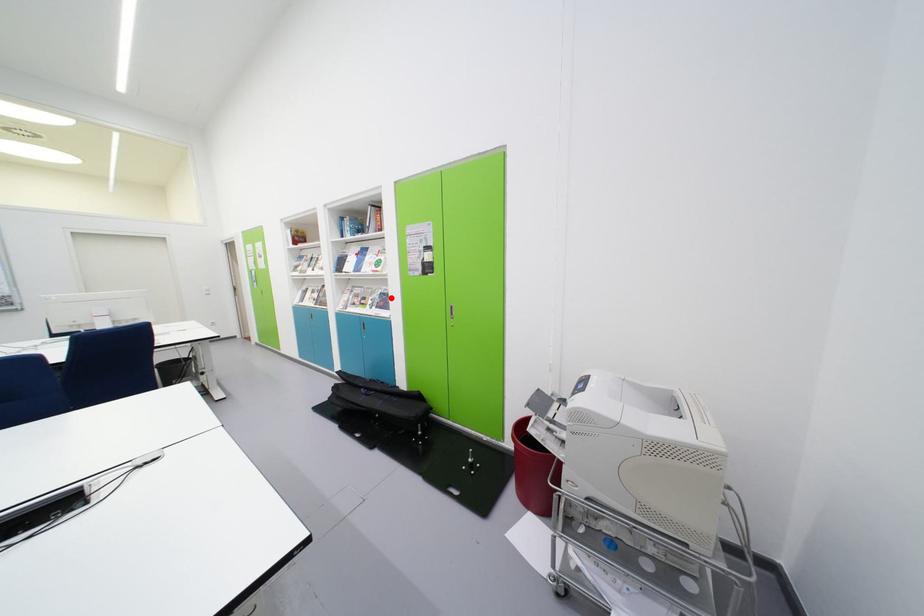
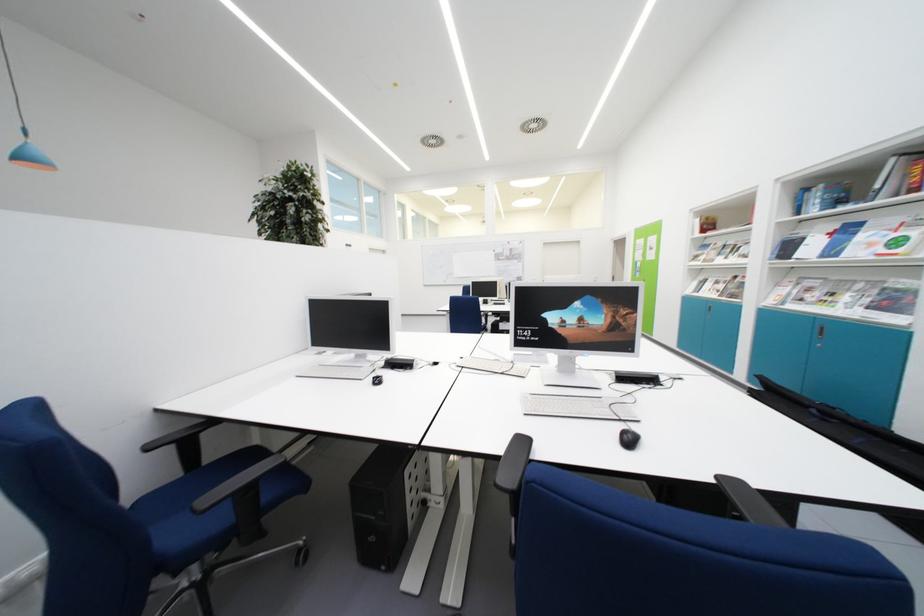
Question: I am providing you with two images of the same scene from different viewpoints. A red point is shown in image1. For the corresponding object point in image2, is it positioned nearer or farther from the camera?

Choices:
 (A) Nearer
 (B) Farther

Answer: (B)